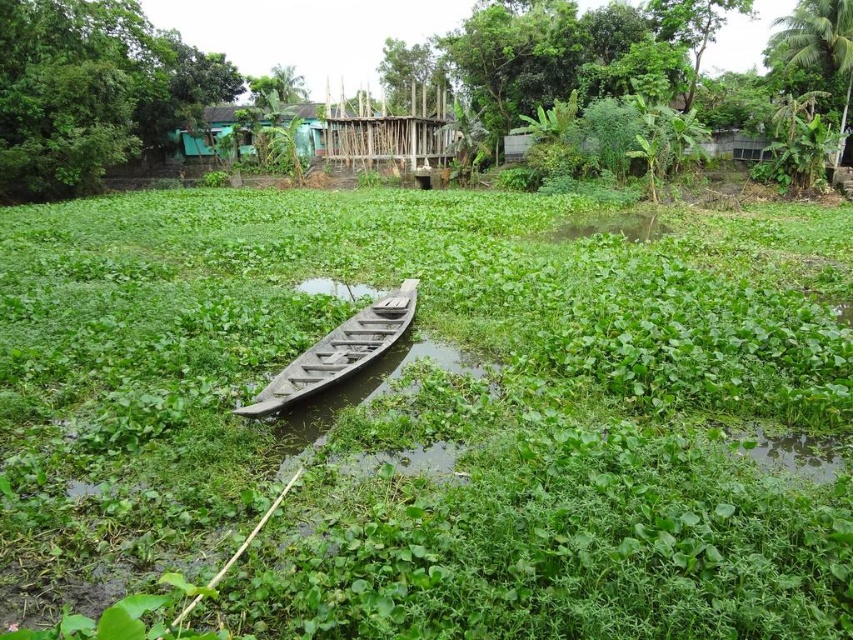
You are a fisherman standing on the wooden canoe at center. You want to reach the green leafy plants at center to collect some leaves. Which direction should you move to get closer to them?

The green leafy plants at center is to the left of wooden canoe at center, so you should move to your left to get closer to them.

You are standing at the edge of the water body in the rural scene. There is a wooden boat partially submerged in the water and a point marked by coordinates. Can you tell me what is located at the coordinates point (598, 68)?

The point (598, 68) marks green leafy plants at center.

You are standing on the bank of the water body and see the green leafy plants at center and the wooden canoe at center. Which object is higher in elevation?

The green leafy plants at center are higher in elevation than the wooden canoe at center because they are positioned above it.